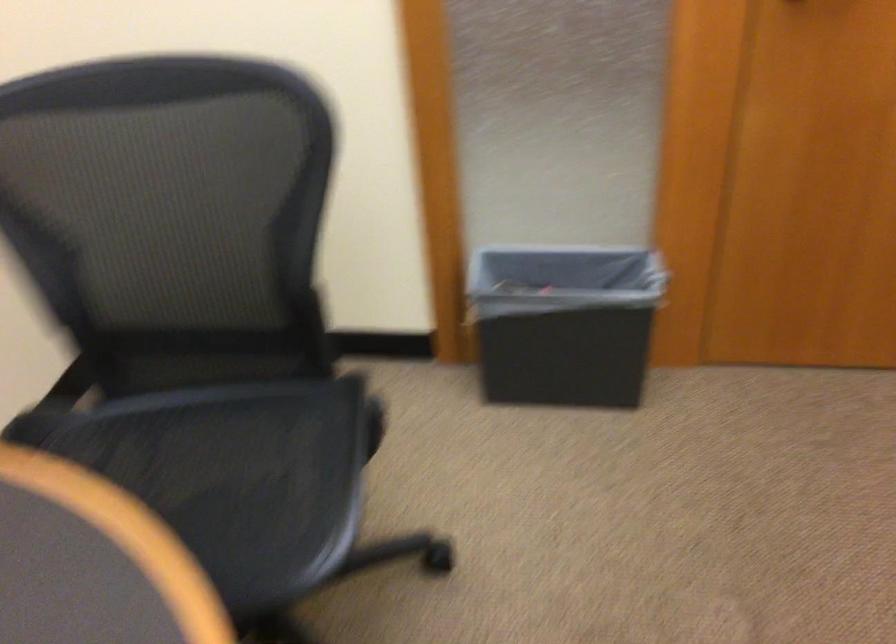
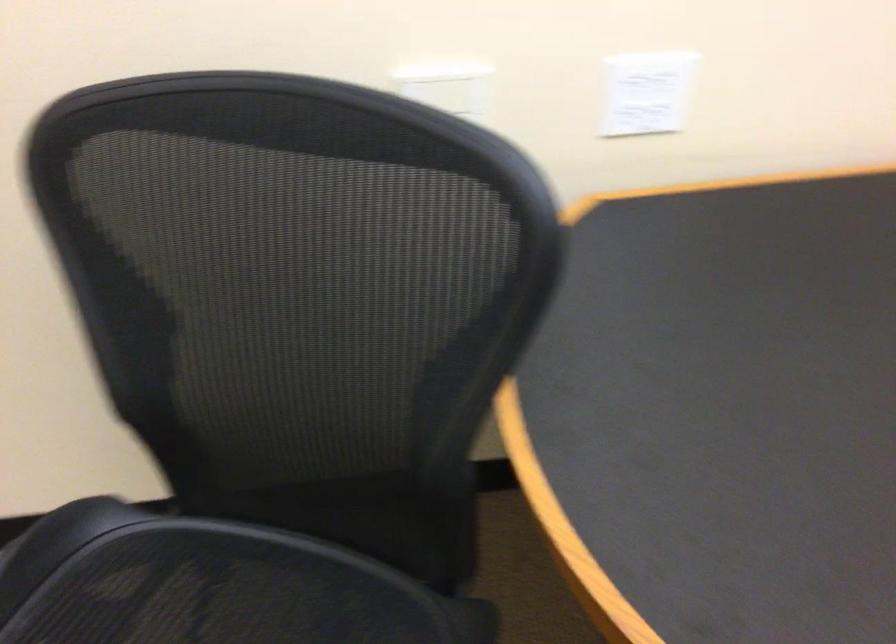
First-person continuous shooting, in which direction is the camera rotating?

The camera rotated toward left-down.